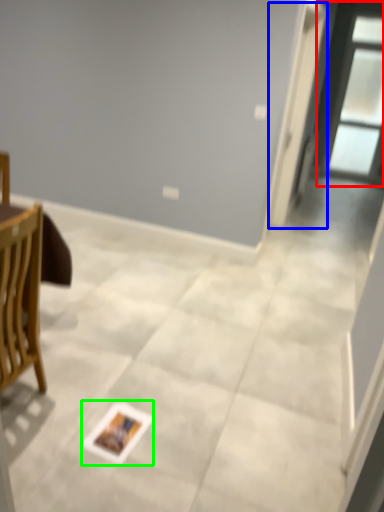
Question: Which object is positioned closest to window (highlighted by a red box)? Select from screen door (highlighted by a blue box) and postcard (highlighted by a green box).

Choices:
 (A) screen door
 (B) postcard

Answer: (A)